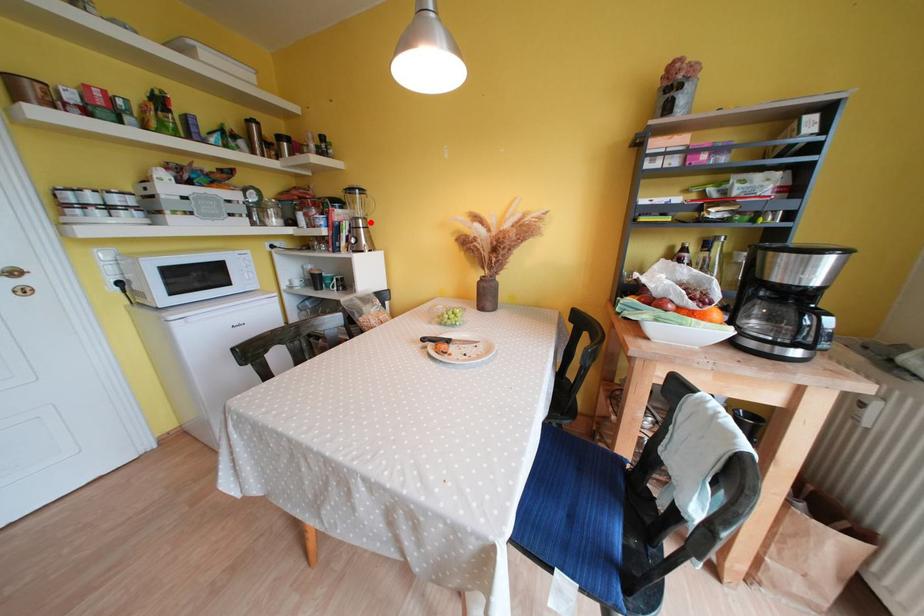
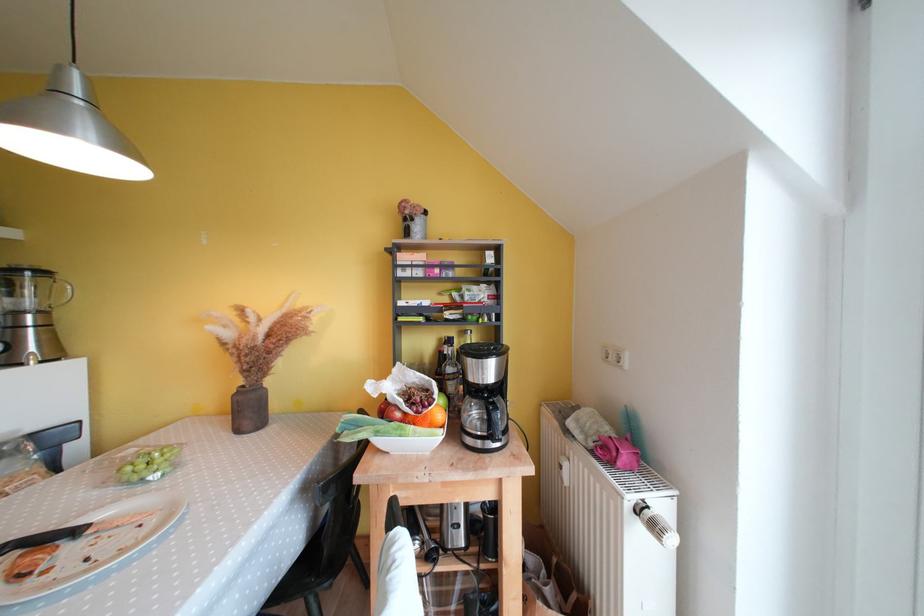
Locate, in the second image, the point that corresponds to the highlighted location in the first image.

(49, 315)